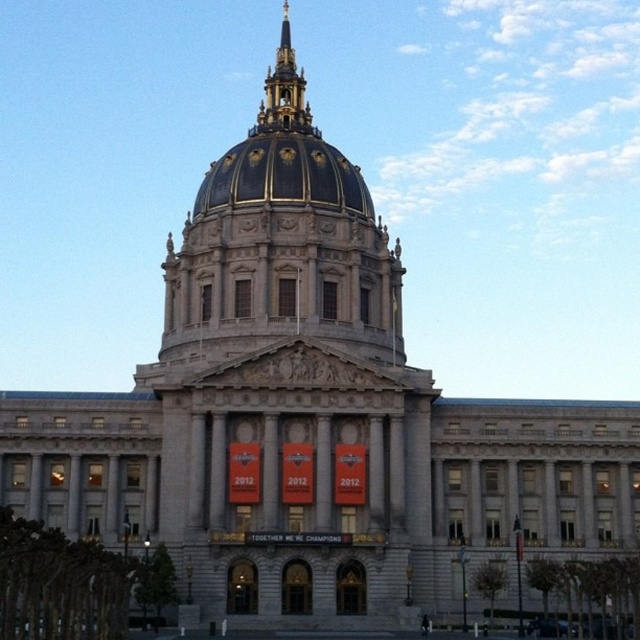
Which is behind, point (259, 230) or point (372, 205)?

Point (372, 205)

Can you confirm if gray stone dome at center is positioned to the left of blue-golden dome at center?

Indeed, gray stone dome at center is positioned on the left side of blue-golden dome at center.

This screenshot has height=640, width=640. What do you see at coordinates (291, 396) in the screenshot?
I see `gray stone dome at center` at bounding box center [291, 396].

You are a GUI agent. You are given a task and a screenshot of the screen. Output one action in this format:
    pyautogui.click(x=<x>, y=<y>)
    Task: Click on the gray stone dome at center
    
    Given the screenshot: What is the action you would take?
    pyautogui.click(x=291, y=396)

Can you confirm if gray stone dome at center is thinner than gold/gilded spire at upper center?

No, gray stone dome at center is not thinner than gold/gilded spire at upper center.

Who is more distant from viewer, [232,472] or [308,129]?

Point [308,129]

Find the location of a particular element. Image resolution: width=640 pixels, height=640 pixels. gray stone dome at center is located at coordinates (291, 396).

Does blue-golden dome at center come behind gold/gilded spire at upper center?

No, blue-golden dome at center is closer to the viewer.

Who is lower down, blue-golden dome at center or gold/gilded spire at upper center?

blue-golden dome at center

Is point (209, 179) positioned after point (282, 116)?

No.

Where is `blue-golden dome at center`? blue-golden dome at center is located at coordinates (284, 176).